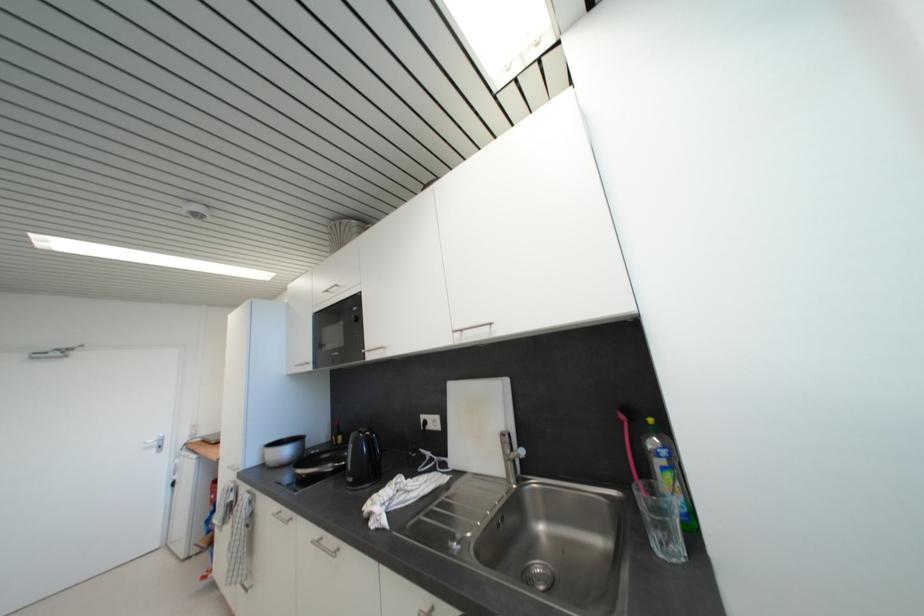
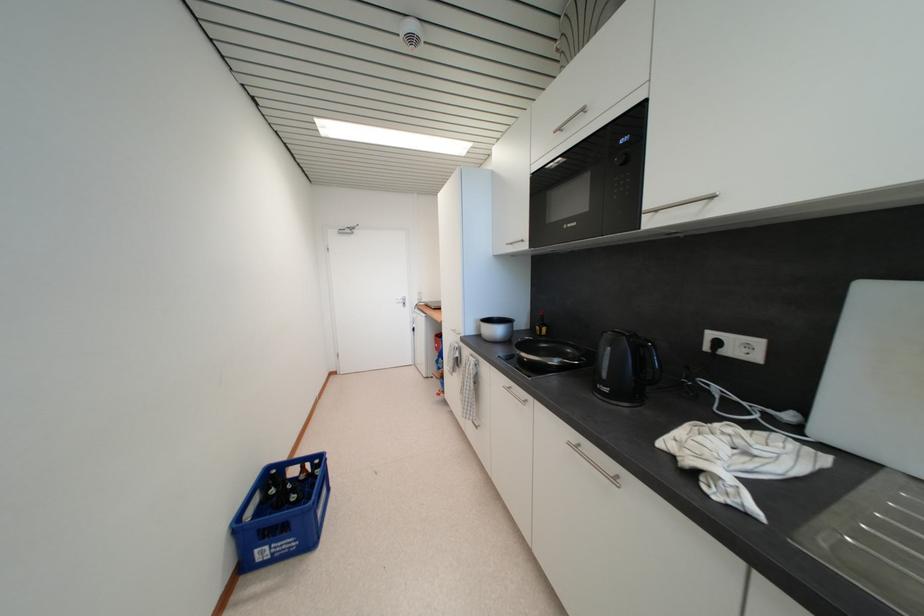
How did the camera likely rotate?

The camera rotated toward left-down.